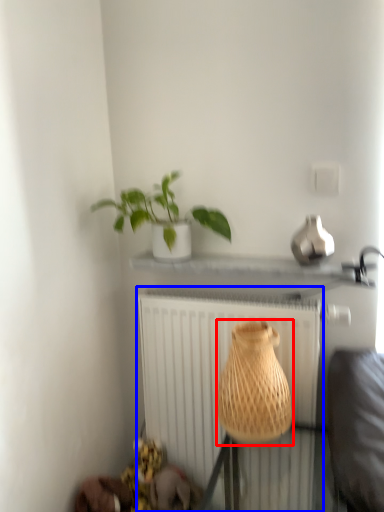
Question: Which object appears closest to the camera in this image, vase (highlighted by a red box) or radiator (highlighted by a blue box)?

Choices:
 (A) vase
 (B) radiator

Answer: (A)